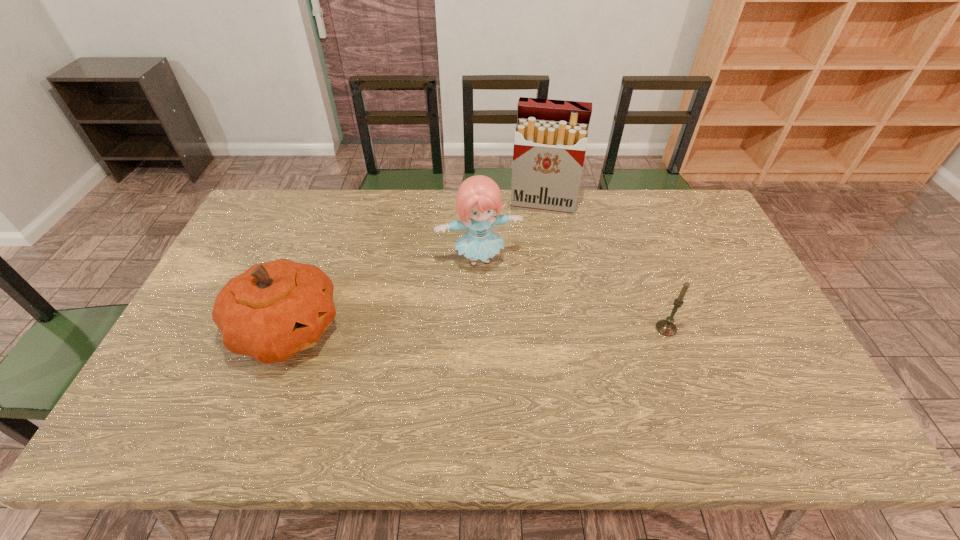
At what (x,y) coordinates should I click in order to perform the action: click on vacant space situated 0.370m with the lid open on the tallest object. Please return your answer as a coordinate pair (x, y). This screenshot has height=540, width=960. Looking at the image, I should click on (528, 293).

Locate an element on the screen. Image resolution: width=960 pixels, height=540 pixels. free region located 0.290m with the lid open on the tallest object is located at coordinates (530, 274).

Where is `free spot located with the lid open on the tallest object`? free spot located with the lid open on the tallest object is located at coordinates (530, 274).

This screenshot has height=540, width=960. Find the location of `vacant space located 0.140m on the front-facing side of the doll`. vacant space located 0.140m on the front-facing side of the doll is located at coordinates (499, 312).

Where is `vacant space situated on the front-facing side of the doll`? The image size is (960, 540). vacant space situated on the front-facing side of the doll is located at coordinates (499, 312).

Image resolution: width=960 pixels, height=540 pixels. I want to click on vacant space situated 0.110m on the front-facing side of the doll, so click(497, 304).

Identify the location of object located in the far edge section of the desktop. This screenshot has height=540, width=960. (551, 136).

Find the location of `object located in the near edge section of the desktop`. object located in the near edge section of the desktop is located at coordinates (272, 311).

In order to click on object at the left edge in this screenshot , I will do 272,311.

Where is `object that is at the near left corner`? The height and width of the screenshot is (540, 960). object that is at the near left corner is located at coordinates (272, 311).